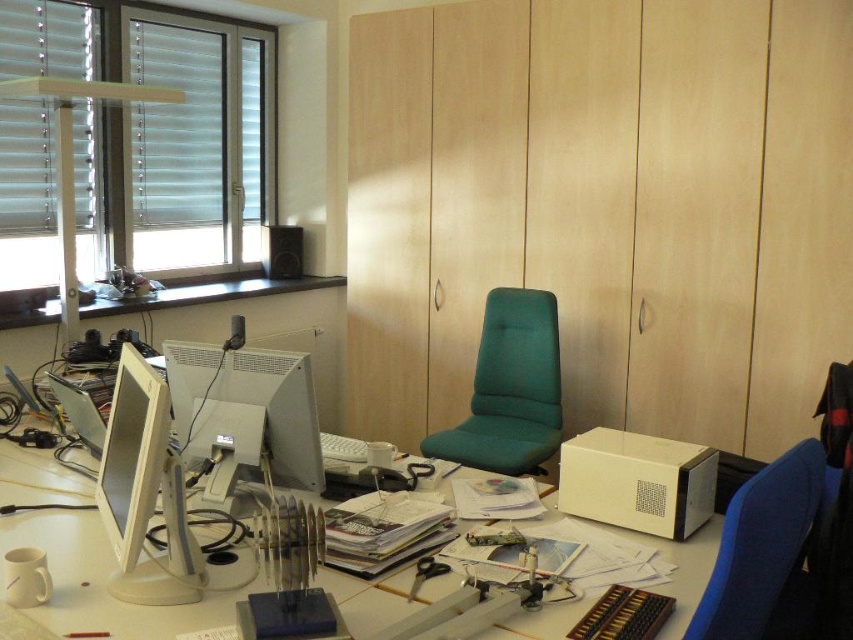
Question: Which object is farther from the camera taking this photo?

Choices:
 (A) blue fabric chair at right
 (B) matte white monitor at left
 (C) green fabric swivel chair at center

Answer: (C)

Question: Is white blinds at upper left bigger than green fabric swivel chair at center?

Choices:
 (A) no
 (B) yes

Answer: (B)

Question: Among these objects, which one is farthest from the camera?

Choices:
 (A) matte white monitor at left
 (B) green fabric swivel chair at center
 (C) white plastic blinds at left
 (D) white plastic table at center

Answer: (C)

Question: Is white blinds at upper left positioned behind matte white monitor at left?

Choices:
 (A) no
 (B) yes

Answer: (B)

Question: Which point appears farthest from the camera in this image?

Choices:
 (A) (305, 365)
 (B) (136, 33)
 (C) (810, 449)
 (D) (111, 449)

Answer: (B)

Question: Does white plastic table at center have a smaller size compared to matte gray monitor at left?

Choices:
 (A) no
 (B) yes

Answer: (A)